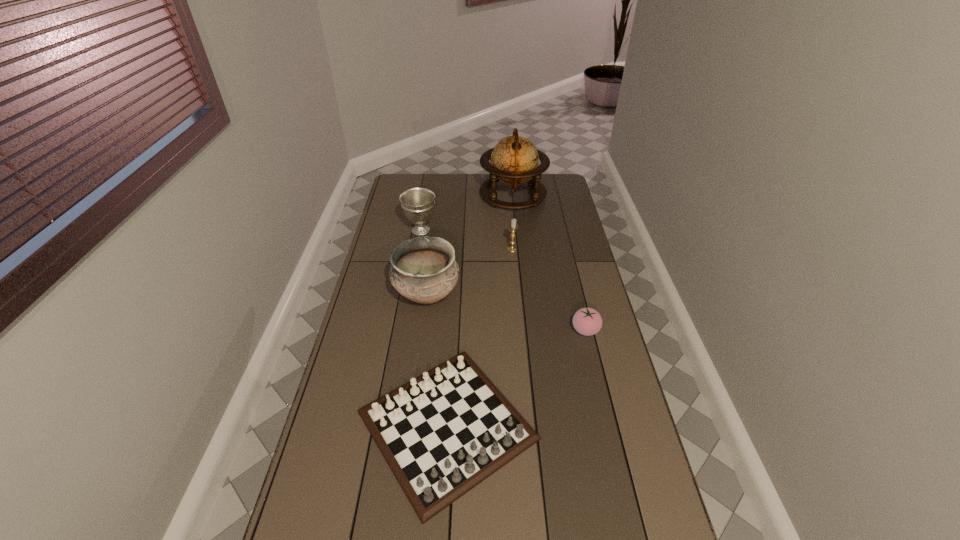
I want to click on the farthest object, so click(x=514, y=160).

The height and width of the screenshot is (540, 960). What are the coordinates of `the tallest object` in the screenshot? It's located at (514, 160).

Locate an element on the screen. pottery is located at coordinates (423, 269).

This screenshot has height=540, width=960. Identify the location of the second farthest object. (418, 203).

In order to click on the fourth nearest object in this screenshot , I will do tap(513, 226).

Identify the location of the second shortest object. (587, 321).

Where is `chessboard`? chessboard is located at coordinates tap(442, 433).

You are a GUI agent. You are given a task and a screenshot of the screen. Output one action in this format:
    pyautogui.click(x=<x>, y=<y>)
    Task: Click on the shortest object
    This screenshot has height=540, width=960.
    Given the screenshot: What is the action you would take?
    pyautogui.click(x=442, y=433)

Identify the location of blank space located on the left of the farthest object. The image size is (960, 540). (427, 195).

Where is `free space located 0.200m on the front of the pottery`? free space located 0.200m on the front of the pottery is located at coordinates (418, 364).